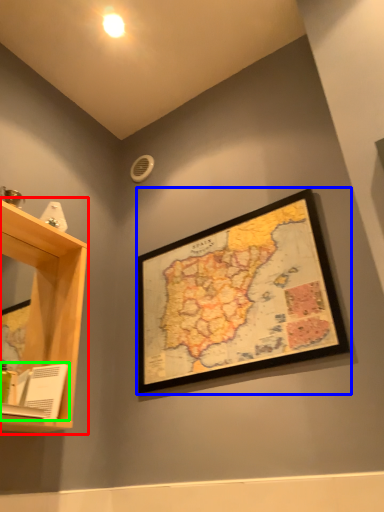
Question: Which object is positioned farthest from shelf (highlighted by a red box)? Select from picture frame (highlighted by a blue box) and book (highlighted by a green box).

Choices:
 (A) picture frame
 (B) book

Answer: (A)